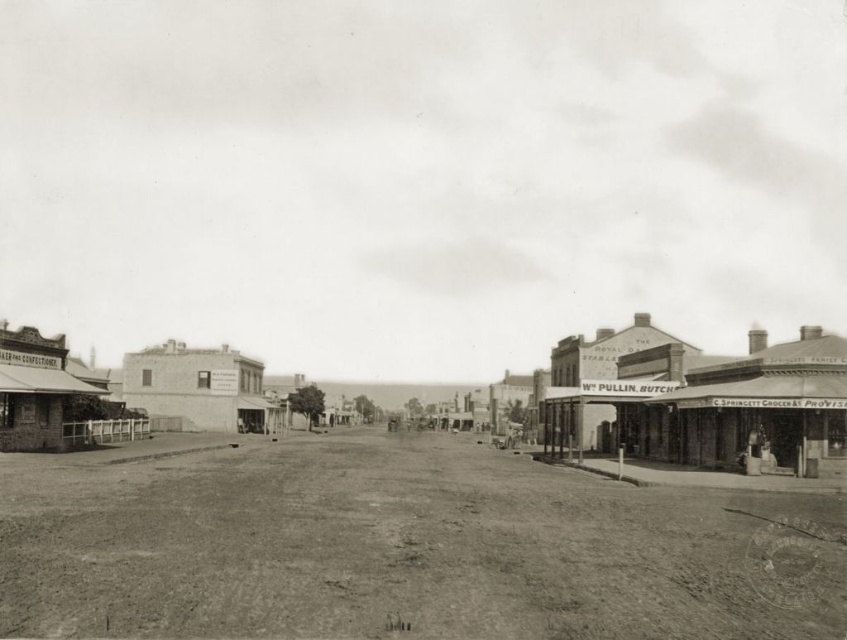
Image resolution: width=847 pixels, height=640 pixels. I want to click on dirt track at center, so click(x=407, y=548).

Does dirt track at center appear under smooth concrete street at center?

Correct, dirt track at center is located below smooth concrete street at center.

Does point (526, 472) come in front of point (663, 424)?

Yes, it is.

I want to click on dirt track at center, so click(407, 548).